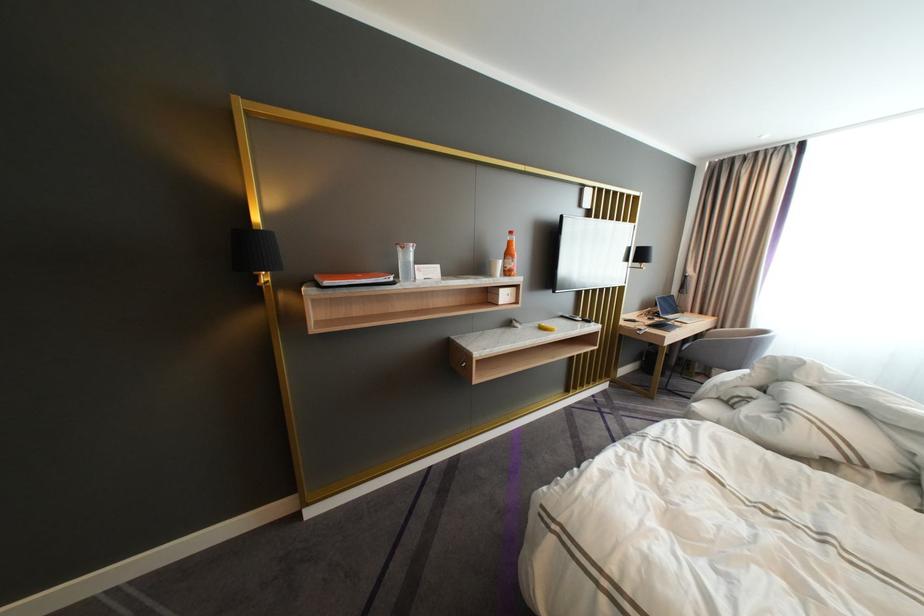
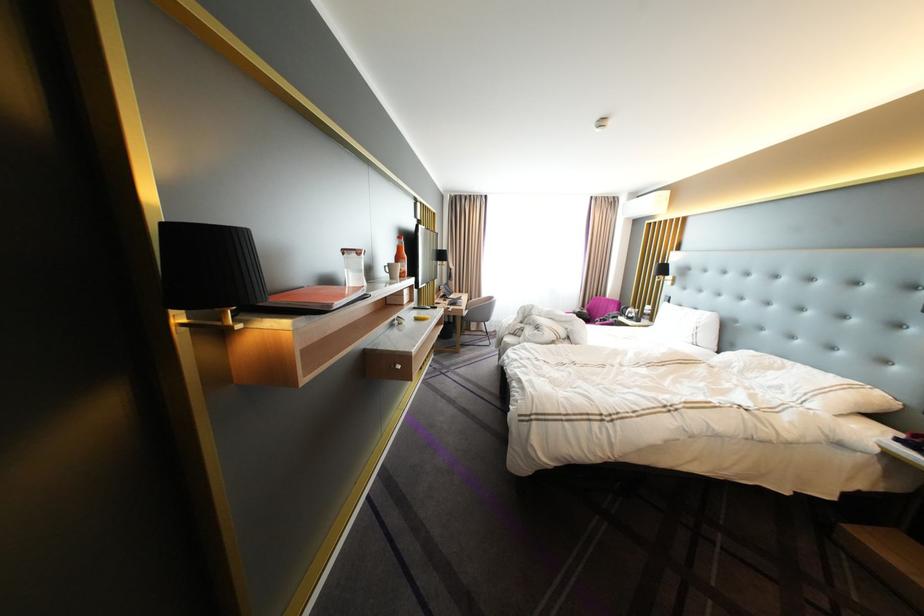
Find the pixel in the second image that matches (x=756, y=326) in the first image.

(492, 296)